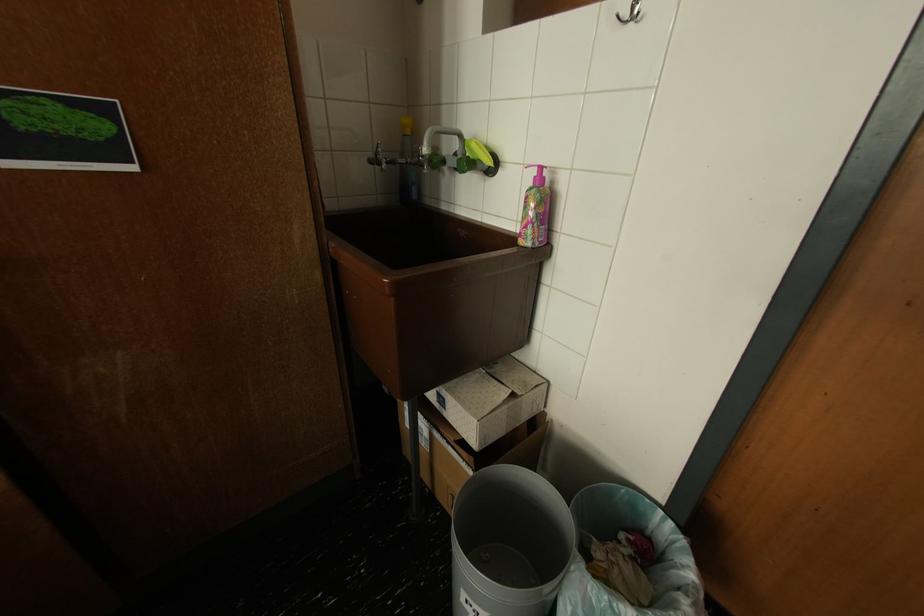
The height and width of the screenshot is (616, 924). In order to click on white cardboard box in this screenshot , I will do `click(490, 400)`.